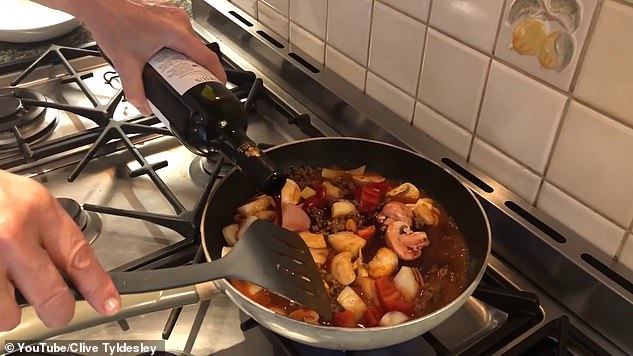
This screenshot has height=356, width=633. What are the coordinates of `white tiled wall` in the screenshot? It's located at (392, 39).